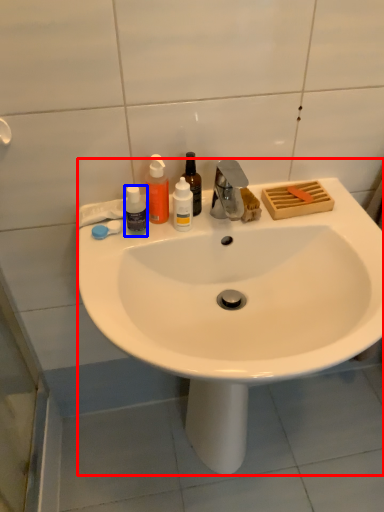
Question: Among these objects, which one is farthest to the camera, sink (highlighted by a red box) or bottle (highlighted by a blue box)?

Choices:
 (A) sink
 (B) bottle

Answer: (B)